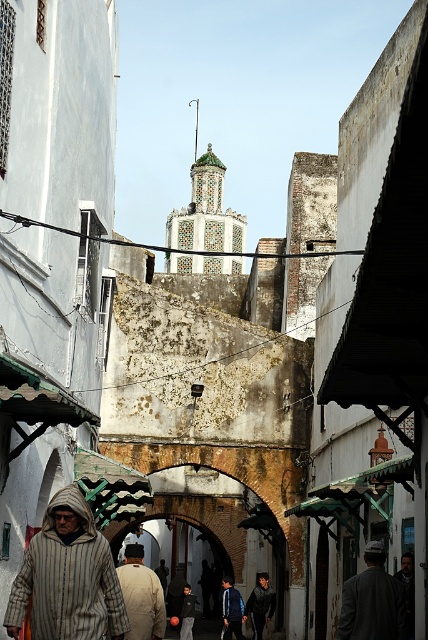
Question: Which point is closer to the camera?

Choices:
 (A) striped woolen robe at lower left
 (B) light brown fabric jacket at lower left
 (C) blue denim jacket at center

Answer: (B)

Question: Can you confirm if striped woolen robe at lower left is positioned to the right of dark blue jacket at center?

Choices:
 (A) no
 (B) yes

Answer: (A)

Question: Is the position of dark gray woolen jacket at center more distant than that of dark blue jacket at center?

Choices:
 (A) yes
 (B) no

Answer: (B)

Question: Does dark gray woolen jacket at center have a lesser width compared to light brown fabric jacket at lower left?

Choices:
 (A) no
 (B) yes

Answer: (B)

Question: Which object is farther from the camera taking this photo?

Choices:
 (A) blue denim jacket at center
 (B) striped woolen robe at lower left

Answer: (A)

Question: Which point is closer to the camera taking this photo?

Choices:
 (A) (131, 618)
 (B) (68, 579)
 (C) (223, 596)
 (D) (389, 589)

Answer: (B)